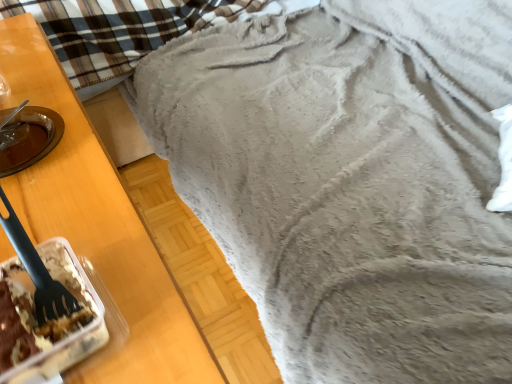
The image size is (512, 384). In order to click on vacant area to the right of black plastic fork at left in this screenshot , I will do `click(143, 283)`.